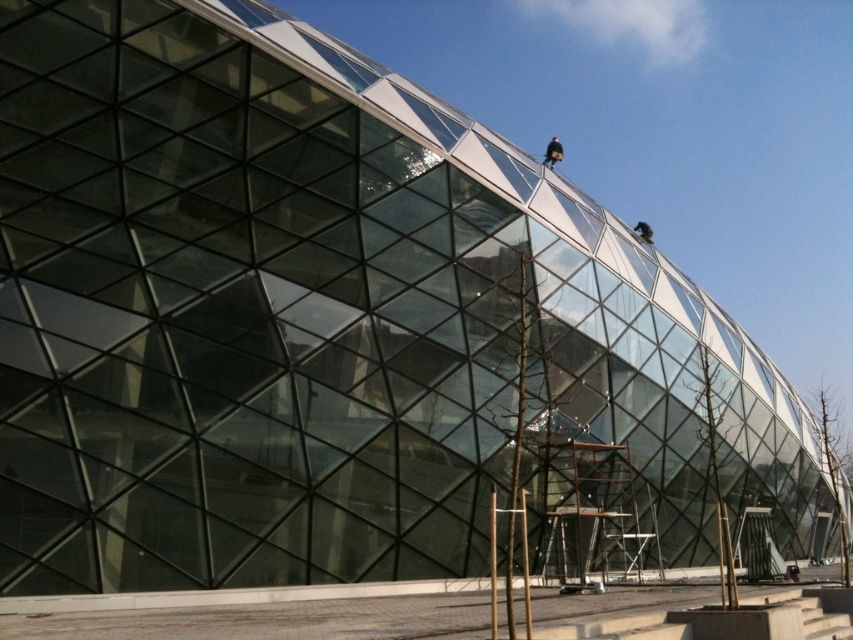
Question: Does black fabric construction worker at upper center have a lesser width compared to dark brown leather helmet at upper right?

Choices:
 (A) no
 (B) yes

Answer: (B)

Question: Among these objects, which one is nearest to the camera?

Choices:
 (A) black fabric construction worker at upper center
 (B) dark brown leather helmet at upper right

Answer: (A)

Question: Can you confirm if black fabric construction worker at upper center is bigger than dark brown leather helmet at upper right?

Choices:
 (A) no
 (B) yes

Answer: (A)

Question: Which object is farther from the camera taking this photo?

Choices:
 (A) dark brown leather helmet at upper right
 (B) black fabric construction worker at upper center

Answer: (A)

Question: Is black fabric construction worker at upper center below dark brown leather helmet at upper right?

Choices:
 (A) yes
 (B) no

Answer: (B)

Question: Which point appears farthest from the camera in this image?

Choices:
 (A) (642, 240)
 (B) (550, 140)

Answer: (B)